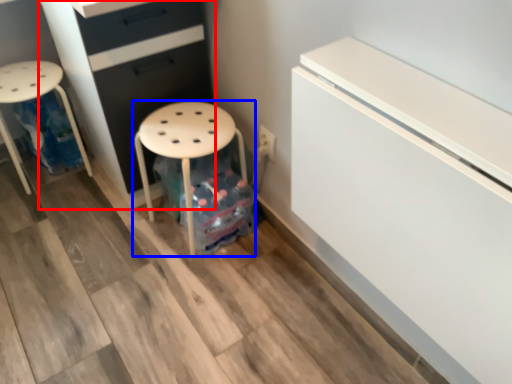
Question: Which object is further to the camera taking this photo, chest of drawers (highlighted by a red box) or stool (highlighted by a blue box)?

Choices:
 (A) chest of drawers
 (B) stool

Answer: (B)